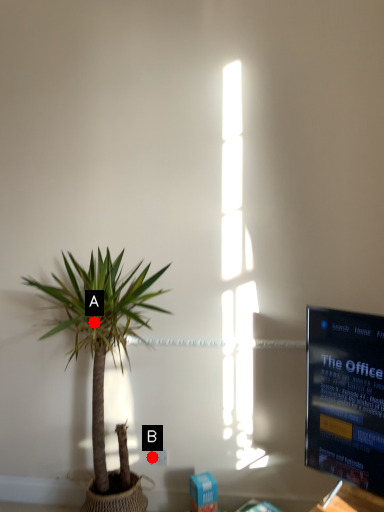
Question: Two points are circled on the image, labeled by A and B beside each circle. Among these points, which one is nearest to the camera?

Choices:
 (A) A is closer
 (B) B is closer

Answer: (A)